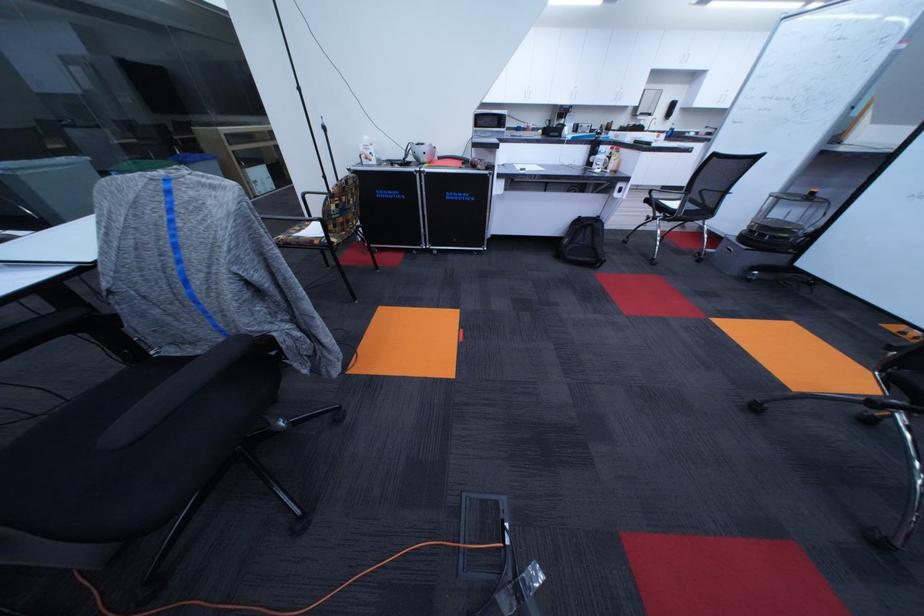
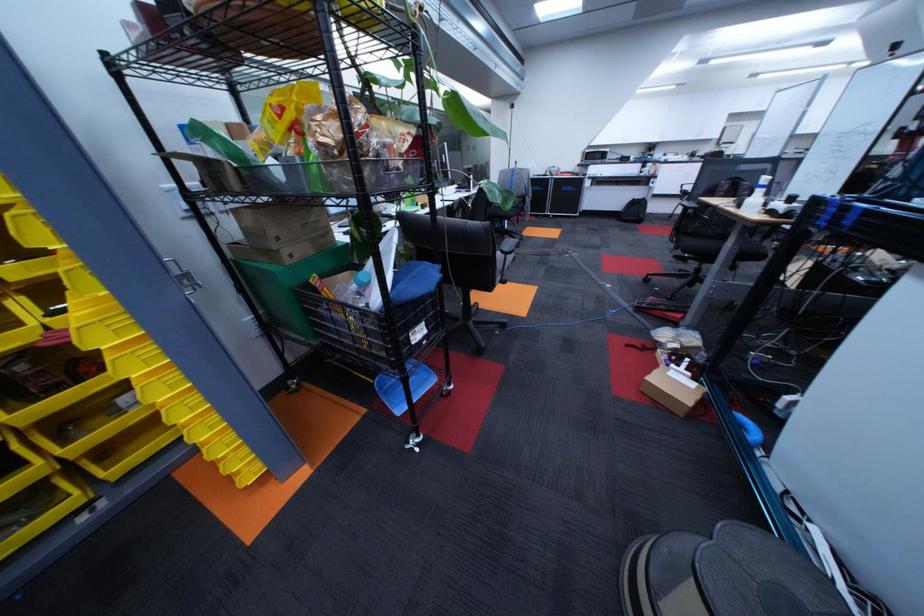
Question: Which direction would the cameraman need to move to produce the second image? Reply with the corresponding letter.

Choices:
 (A) Left
 (B) Right
 (C) Forward
 (D) Backward

Answer: (D)